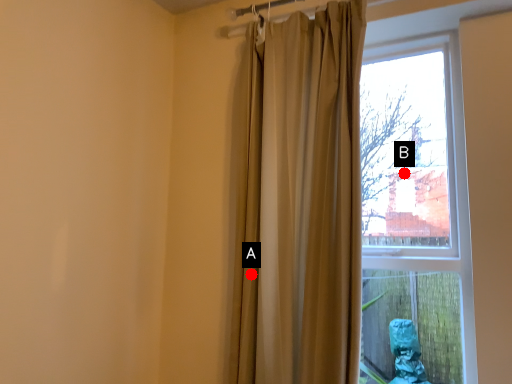
Question: Two points are circled on the image, labeled by A and B beside each circle. Which of the following is the farthest from the observer?

Choices:
 (A) A is further
 (B) B is further

Answer: (B)